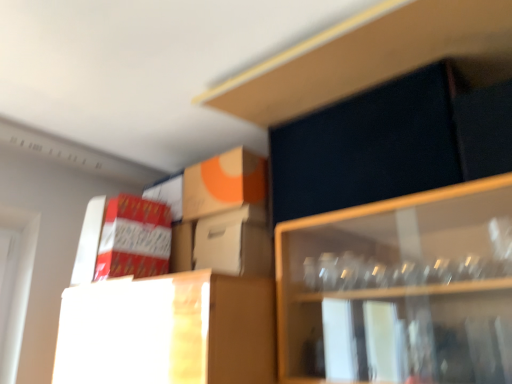
Question: Based on their sizes in the image, would you say dark matte cabinet at upper right is bigger or smaller than white cardboard box at center, which appears as the first cardboard box when viewed from the right?

Choices:
 (A) big
 (B) small

Answer: (A)

Question: From the image's perspective, is dark matte cabinet at upper right above or below white cardboard box at center, marked as the 3th cardboard box in a left-to-right arrangement?

Choices:
 (A) below
 (B) above

Answer: (B)

Question: Estimate the real-world distances between objects in this image. Which object is farther from the dark matte cabinet at upper right?

Choices:
 (A) red cardboard box at left, placed as the 3th cardboard box when sorted from right to left
 (B) white cardboard box at center, marked as the 3th cardboard box in a left-to-right arrangement
 (C) orange matte cardboard box at upper center, placed as the 2th cardboard box when sorted from left to right

Answer: (A)

Question: Which object is positioned farthest from the dark matte cabinet at upper right?

Choices:
 (A) red cardboard box at left, the first cardboard box viewed from the left
 (B) orange matte cardboard box at upper center, placed as the 2th cardboard box when sorted from left to right
 (C) white cardboard box at center, marked as the 3th cardboard box in a left-to-right arrangement

Answer: (A)